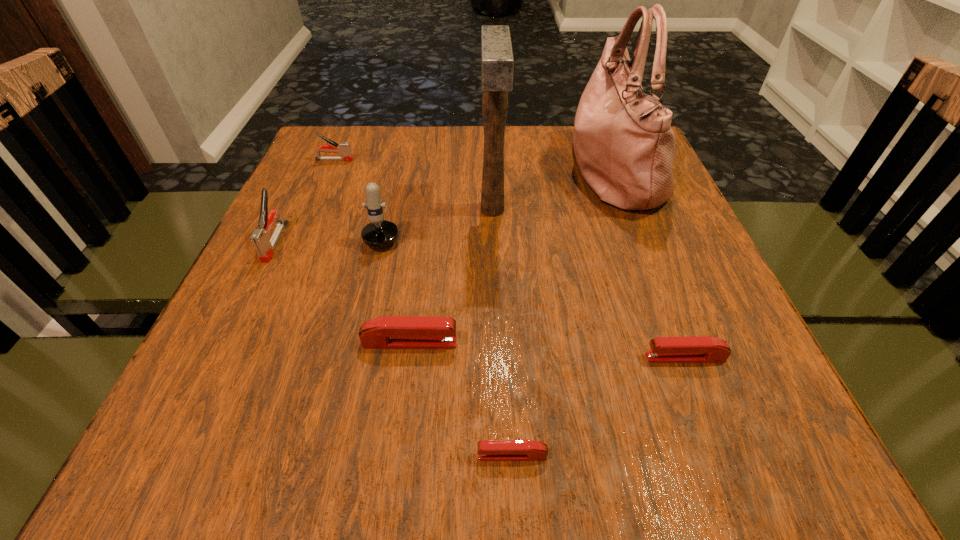
The image size is (960, 540). In order to click on object that is at the near edge in this screenshot , I will do point(488,450).

Find the location of a particular element. This screenshot has width=960, height=540. handbag present at the right edge is located at coordinates (624, 145).

I want to click on stapler located in the right edge section of the desktop, so click(699, 349).

In order to click on object present at the far left corner in this screenshot , I will do `click(344, 149)`.

You are a GUI agent. You are given a task and a screenshot of the screen. Output one action in this format:
    pyautogui.click(x=<x>, y=<y>)
    Task: Click on the object that is positioned at the far right corner
    This screenshot has height=540, width=960.
    Given the screenshot: What is the action you would take?
    624,145

Find the location of `free region at the far edge`. free region at the far edge is located at coordinates (477, 136).

This screenshot has width=960, height=540. In the image, there is a desktop. Find the location of `vacant region at the near edge`. vacant region at the near edge is located at coordinates (466, 434).

Where is `vacant space at the left edge of the desktop`? vacant space at the left edge of the desktop is located at coordinates (200, 360).

In the image, there is a desktop. At what (x,y) coordinates should I click in order to perform the action: click on vacant space at the right edge. Please return your answer as a coordinate pair (x, y). Looking at the image, I should click on (612, 214).

Where is `free space at the far left corner of the desktop`? The height and width of the screenshot is (540, 960). free space at the far left corner of the desktop is located at coordinates (379, 125).